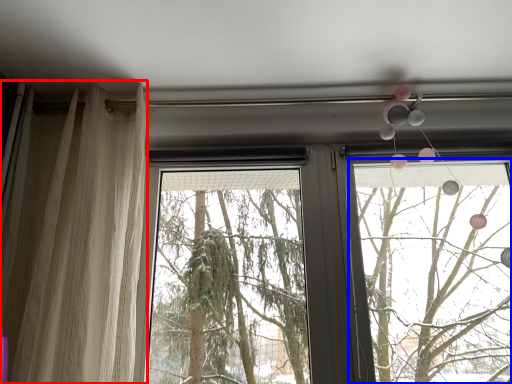
Question: Among these objects, which one is nearest to the camera, curtain (highlighted by a red box) or window frame (highlighted by a blue box)?

Choices:
 (A) curtain
 (B) window frame

Answer: (A)